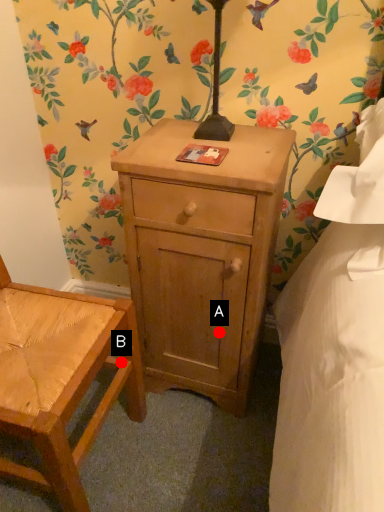
Question: Two points are circled on the image, labeled by A and B beside each circle. Among these points, which one is farthest from the camera?

Choices:
 (A) A is further
 (B) B is further

Answer: (A)